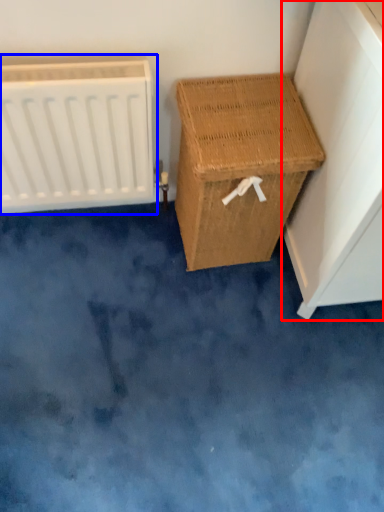
Question: Which object appears closest to the camera in this image, furniture (highlighted by a red box) or radiator (highlighted by a blue box)?

Choices:
 (A) furniture
 (B) radiator

Answer: (A)